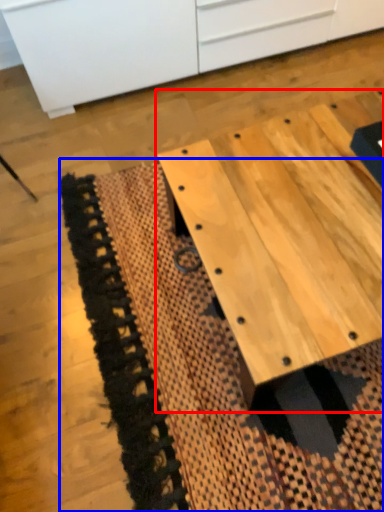
Question: Among these objects, which one is nearest to the camera, table (highlighted by a red box) or mat (highlighted by a blue box)?

Choices:
 (A) table
 (B) mat

Answer: (A)